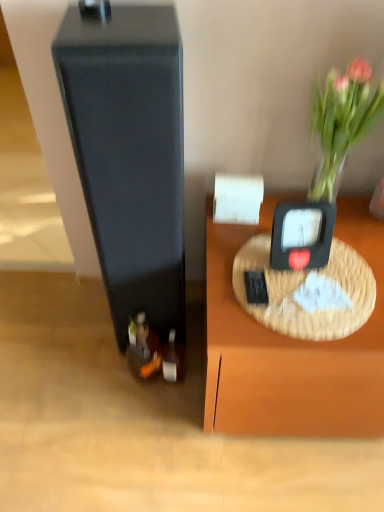
I want to click on vacant area to the left of shiny silver wine bottle at lower center, which is the second wine bottle in left-to-right order, so click(x=128, y=400).